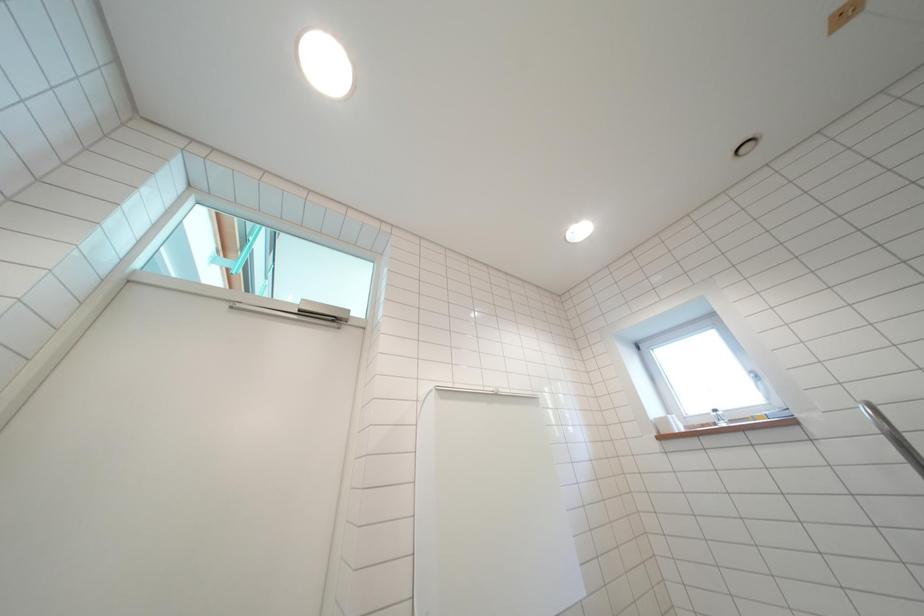
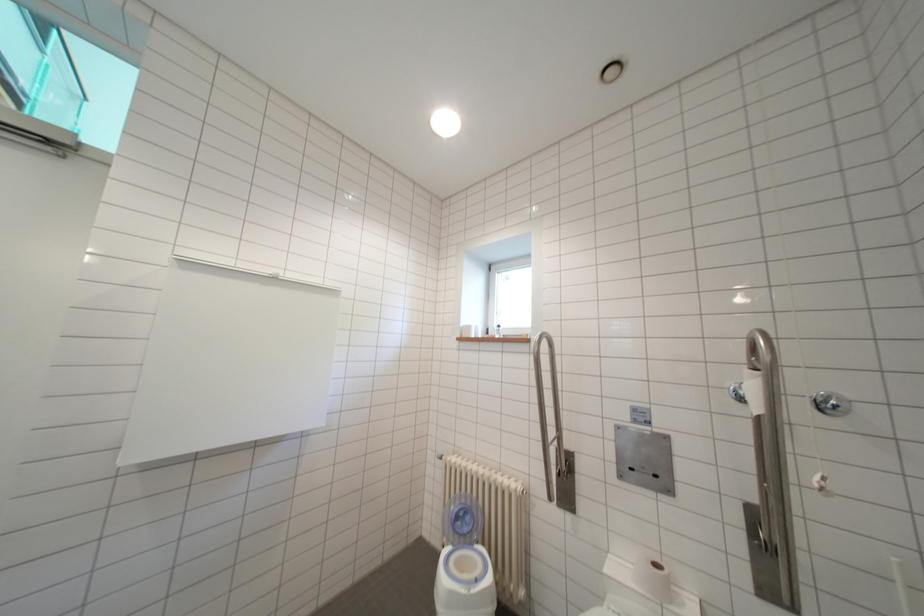
Question: The images are taken continuously from a first-person perspective. In which direction are you moving?

Choices:
 (A) Left
 (B) Right
 (C) Forward
 (D) Backward

Answer: (B)